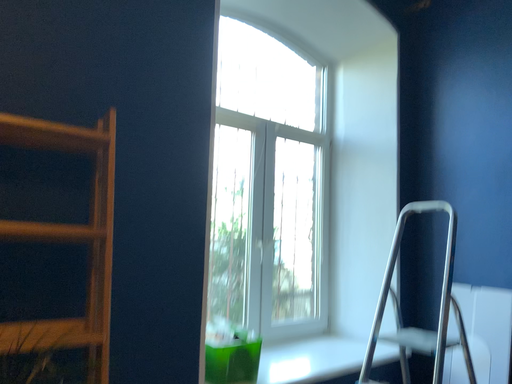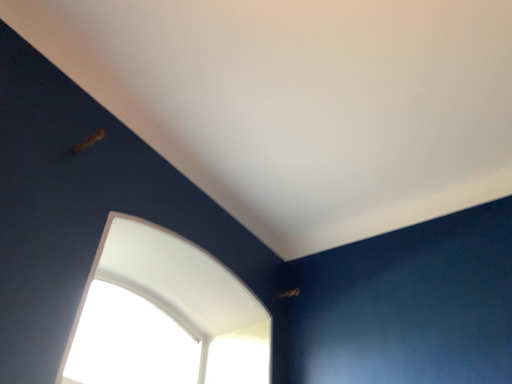
Question: Which way did the camera rotate in the video?

Choices:
 (A) rotated downward
 (B) rotated upward

Answer: (B)